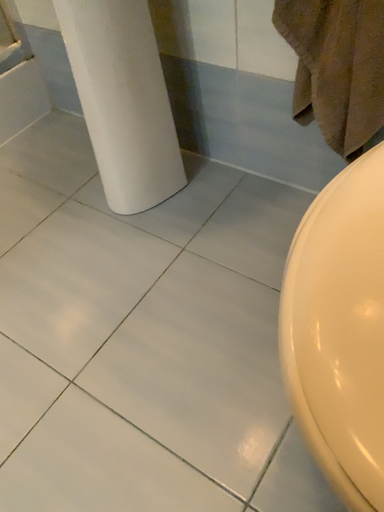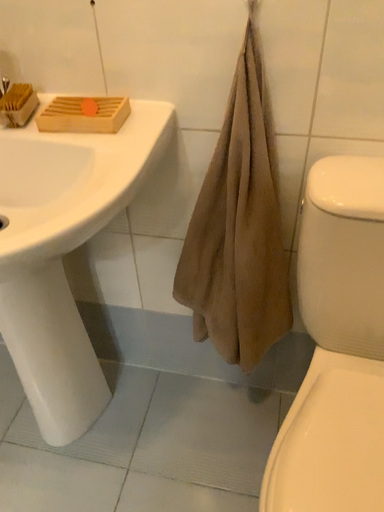
Question: Which way did the camera rotate in the video?

Choices:
 (A) rotated downward
 (B) rotated upward

Answer: (B)